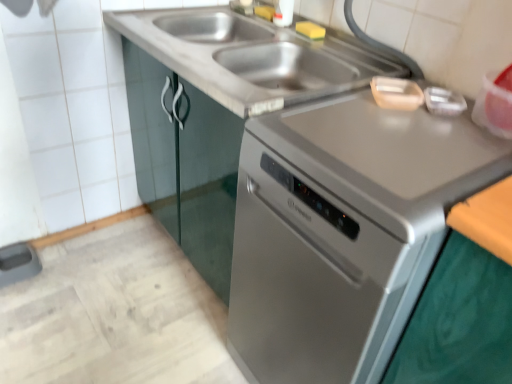
Where is `stainless steel sink at center`? stainless steel sink at center is located at coordinates (251, 57).

Describe the element at coordinates (251, 57) in the screenshot. I see `stainless steel sink at center` at that location.

Consider the image. What is the approximate width of stainless steel sink at center?

24.15 inches.

Describe the element at coordinates (315, 278) in the screenshot. I see `satin silver dishwasher at center` at that location.

Locate an element on the screen. Image resolution: width=512 pixels, height=384 pixels. satin silver dishwasher at center is located at coordinates click(x=315, y=278).

At what (x,y) coordinates should I click in order to perform the action: click on stainless steel sink at center. Please return your answer as a coordinate pair (x, y). Looking at the image, I should click on (251, 57).

Which is more to the left, stainless steel sink at center or satin silver dishwasher at center?

stainless steel sink at center is more to the left.

Is stainless steel sink at center in front of or behind satin silver dishwasher at center in the image?

stainless steel sink at center is behind satin silver dishwasher at center.

Considering the points (243, 29) and (249, 142), which point is in front, point (243, 29) or point (249, 142)?

The point (249, 142) is more forward.

From the image's perspective, between stainless steel sink at center and satin silver dishwasher at center, who is located below?

satin silver dishwasher at center, from the image's perspective.

From a real-world perspective, who is located lower, stainless steel sink at center or satin silver dishwasher at center?

satin silver dishwasher at center is physically lower.

Does stainless steel sink at center have a lesser width compared to satin silver dishwasher at center?

Correct, the width of stainless steel sink at center is less than that of satin silver dishwasher at center.

Which of these two, stainless steel sink at center or satin silver dishwasher at center, stands taller?

With more height is satin silver dishwasher at center.

Considering the sizes of stainless steel sink at center and satin silver dishwasher at center in the image, is stainless steel sink at center bigger or smaller than satin silver dishwasher at center?

In the image, stainless steel sink at center appears to be smaller than satin silver dishwasher at center.

Is satin silver dishwasher at center completely or partially inside stainless steel sink at center?

That's incorrect, satin silver dishwasher at center is not inside stainless steel sink at center.

Is the surface of stainless steel sink at center in direct contact with satin silver dishwasher at center?

stainless steel sink at center is not next to satin silver dishwasher at center, and they're not touching.

Could you tell me if stainless steel sink at center is facing satin silver dishwasher at center?

No, stainless steel sink at center is not facing towards satin silver dishwasher at center.

Can you tell me how much stainless steel sink at center and satin silver dishwasher at center differ in facing direction?

There is a 0.000236-degree angle between the facing directions of stainless steel sink at center and satin silver dishwasher at center.

This screenshot has width=512, height=384. I want to click on oven on the right of stainless steel sink at center, so 315,278.

Does satin silver dishwasher at center appear on the left side of stainless steel sink at center?

In fact, satin silver dishwasher at center is to the right of stainless steel sink at center.

From the picture: Is the depth of satin silver dishwasher at center greater than that of stainless steel sink at center?

No, satin silver dishwasher at center is closer to the viewer.

Is point (288, 258) closer to viewer compared to point (372, 49)?

Yes, point (288, 258) is closer to viewer.

From the image's perspective, is satin silver dishwasher at center located above or below stainless steel sink at center?

Based on their image positions, satin silver dishwasher at center is located beneath stainless steel sink at center.

From a real-world perspective, is satin silver dishwasher at center beneath stainless steel sink at center?

Indeed, from a real-world perspective, satin silver dishwasher at center is positioned beneath stainless steel sink at center.

Does satin silver dishwasher at center have a greater width compared to stainless steel sink at center?

Yes, satin silver dishwasher at center is wider than stainless steel sink at center.

Does satin silver dishwasher at center have a lesser height compared to stainless steel sink at center?

Incorrect, the height of satin silver dishwasher at center does not fall short of that of stainless steel sink at center.

Can you confirm if satin silver dishwasher at center is smaller than stainless steel sink at center?

No, satin silver dishwasher at center is not smaller than stainless steel sink at center.

Is satin silver dishwasher at center completely or partially outside of stainless steel sink at center?

satin silver dishwasher at center is positioned outside stainless steel sink at center.

Are satin silver dishwasher at center and stainless steel sink at center located far from each other?

Actually, satin silver dishwasher at center and stainless steel sink at center are a little close together.

Does satin silver dishwasher at center turn towards stainless steel sink at center?

No, satin silver dishwasher at center is not aimed at stainless steel sink at center.

Locate an element on the screen. oven below the stainless steel sink at center (from a real-world perspective) is located at coordinates (315, 278).

At what (x,y) coordinates should I click in order to perform the action: click on sink above the satin silver dishwasher at center (from the image's perspective). Please return your answer as a coordinate pair (x, y). Looking at the image, I should click on (251, 57).

At what (x,y) coordinates should I click in order to perform the action: click on oven in front of the stainless steel sink at center. Please return your answer as a coordinate pair (x, y). Looking at the image, I should click on (315, 278).